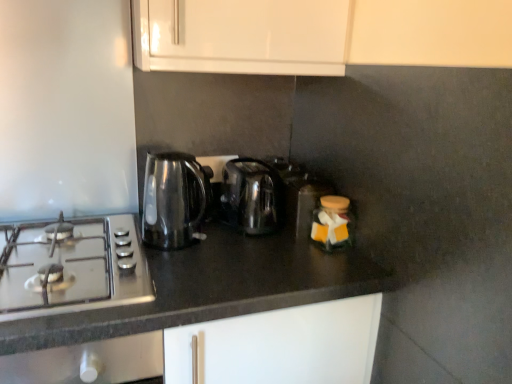
Locate an element on the screen. This screenshot has height=384, width=512. free space in front of stainless steel kettle at center, which is the second kitchen appliance from left to right is located at coordinates point(246,251).